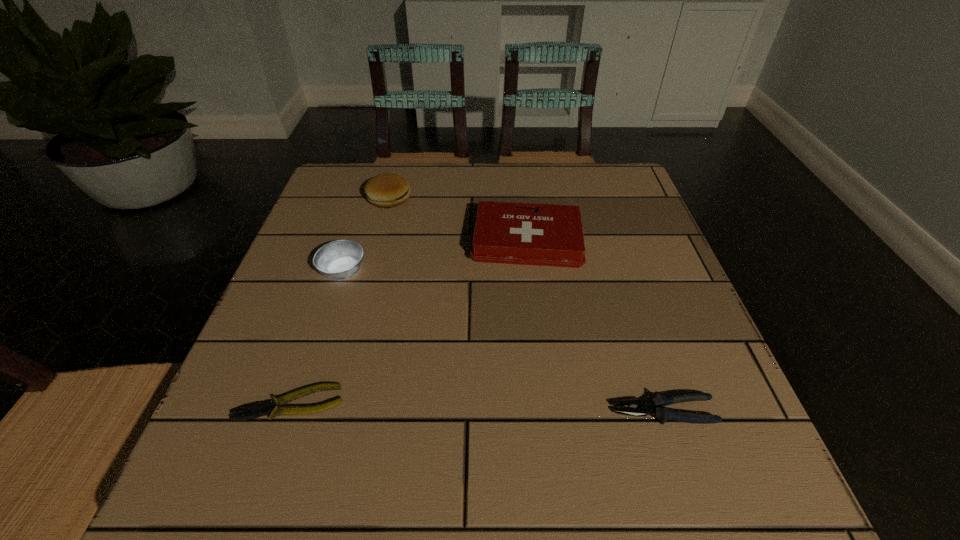
Where is `the tallest object`? The image size is (960, 540). the tallest object is located at coordinates (387, 190).

Locate an element on the screen. the farthest object is located at coordinates (387, 190).

The width and height of the screenshot is (960, 540). In order to click on the first-aid kit in this screenshot , I will do `click(552, 235)`.

Where is `ashtray`? This screenshot has height=540, width=960. ashtray is located at coordinates (339, 260).

What are the coordinates of `the fourth tallest object` in the screenshot? It's located at (654, 406).

Identify the location of the taller pliers. (654, 406).

The height and width of the screenshot is (540, 960). I want to click on the left pliers, so (259, 409).

The height and width of the screenshot is (540, 960). I want to click on the shortest object, so click(259, 409).

I want to click on blank space located on the left of the farthest object, so click(331, 198).

At what (x,y) coordinates should I click in order to perform the action: click on vacant area located on the front of the first-aid kit. Please return your answer as a coordinate pair (x, y). Looking at the image, I should click on (537, 321).